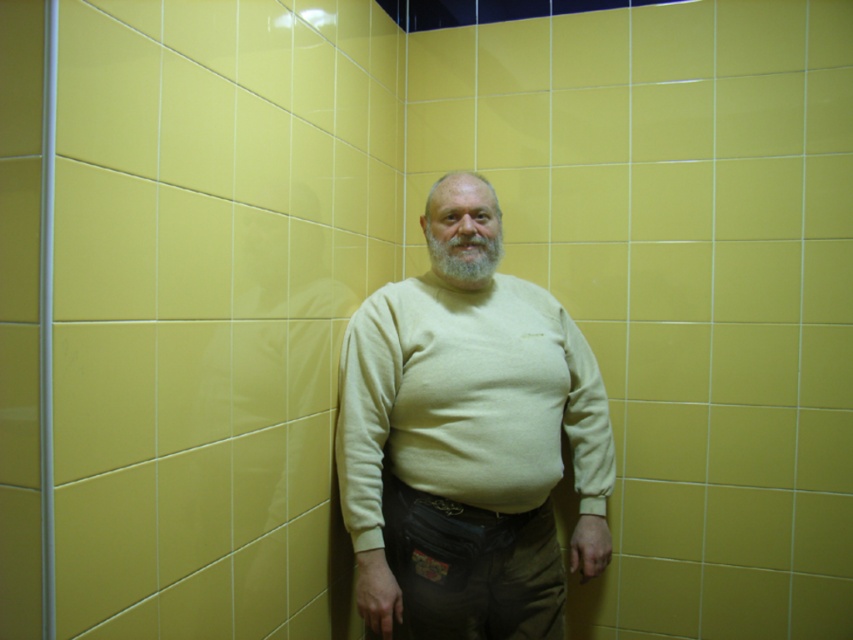
Does beige cotton sweater at center have a larger size compared to gray matte beard at center?

Yes.

Between point (341, 449) and point (463, 288), which one is positioned in front?

Point (341, 449) is more forward.

Is point (440, 560) closer to viewer compared to point (463, 282)?

Yes, it is in front of point (463, 282).

The image size is (853, 640). What are the coordinates of `beige cotton sweater at center` in the screenshot? It's located at (468, 458).